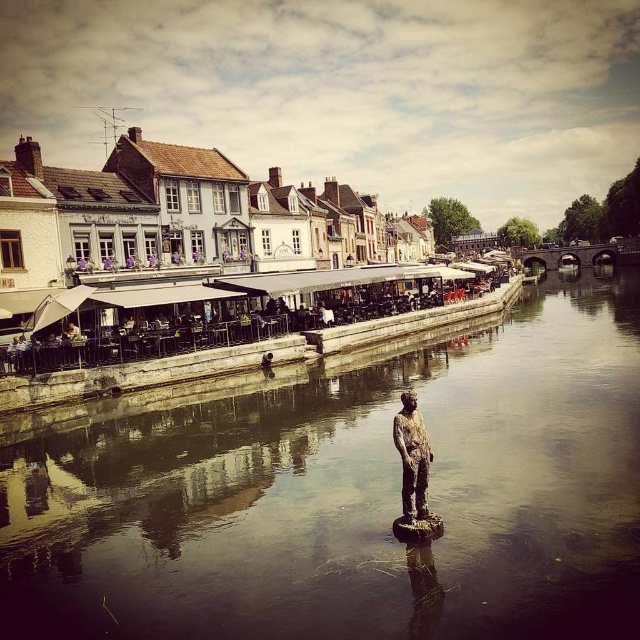
In the scene shown: You are standing at the riverside and want to take a photo of the statue in the water. You notice two points marked in the image. One is at point (33, 592) and the other at point (420, 445). Which point is closer to your current position?

Point (33, 592) is closer to the camera than point (420, 445), so it is closer to your current position.

You are a tourist holding a camera and want to take a photo of both the smooth reflective water at center and the bronze statue at center. Since you want to ensure both are clearly visible, which object should you focus on first to make sure it is in frame?

The smooth reflective water at center has a larger size compared to bronze statue at center, so you should focus on the smooth reflective water at center first to ensure it fits within the frame.